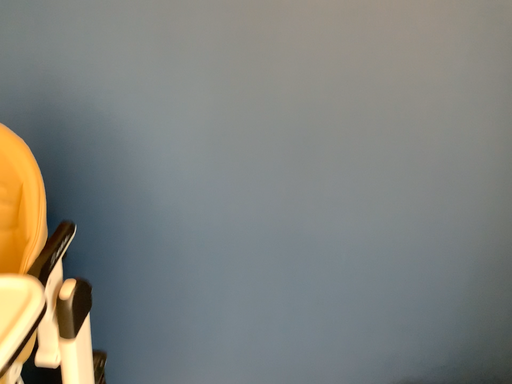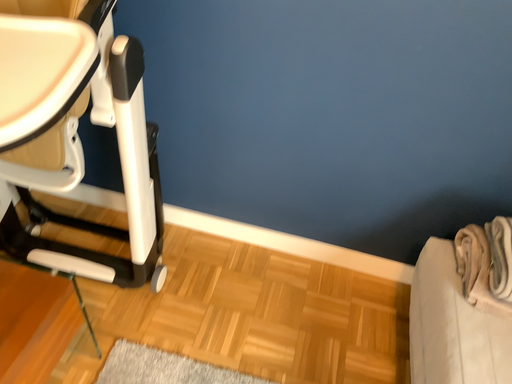
Question: How did the camera likely rotate when shooting the video?

Choices:
 (A) rotated downward
 (B) rotated upward

Answer: (A)